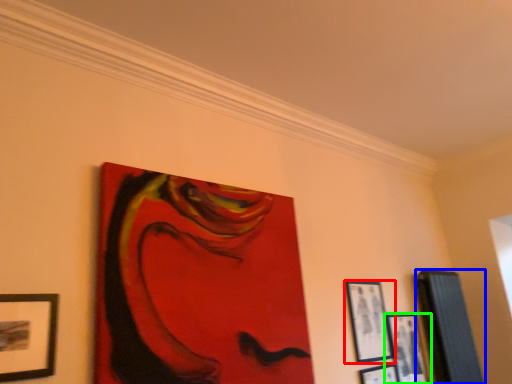
Question: Based on their relative distances, which object is nearer to picture frame (highlighted by a red box)? Choose from picture frame (highlighted by a blue box) and picture frame (highlighted by a green box).

Choices:
 (A) picture frame
 (B) picture frame

Answer: (B)